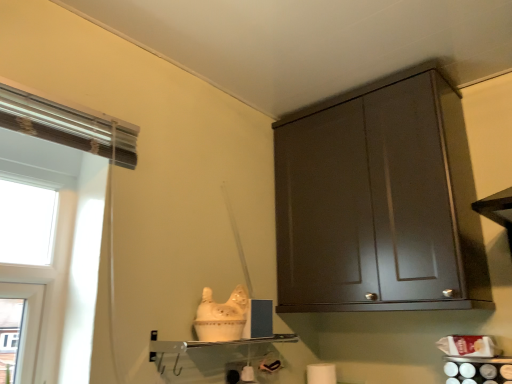
Question: Considering the positions of dark wood cabinet at upper right and clear glass shelf at center in the image, is dark wood cabinet at upper right bigger or smaller than clear glass shelf at center?

Choices:
 (A) big
 (B) small

Answer: (A)

Question: Is point (380, 306) closer or farther from the camera than point (222, 344)?

Choices:
 (A) closer
 (B) farther

Answer: (B)

Question: Estimate the real-world distances between objects in this image. Which object is closer to the dark wood cabinet at upper right?

Choices:
 (A) white matte toilet paper at lower center
 (B) clear glass shelf at center

Answer: (B)

Question: Which object is positioned farthest from the dark wood cabinet at upper right?

Choices:
 (A) clear glass shelf at center
 (B) white matte toilet paper at lower center

Answer: (B)